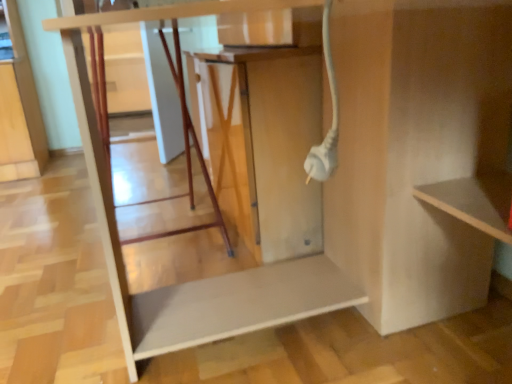
Where is `white matte plug at center`? The width and height of the screenshot is (512, 384). white matte plug at center is located at coordinates 264,142.

Describe the element at coordinates (264, 142) in the screenshot. I see `white matte plug at center` at that location.

Identify the location of white matte plug at center. (264, 142).